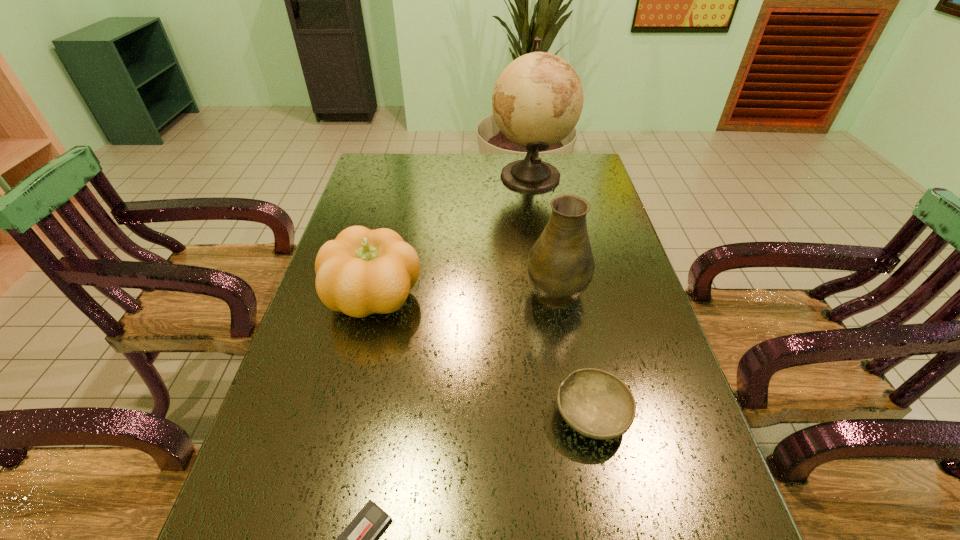
Where is `free spot located on the handle side of the pitcher`? free spot located on the handle side of the pitcher is located at coordinates coord(541,206).

This screenshot has height=540, width=960. In order to click on vacant space situated 0.400m on the handle side of the pitcher in this screenshot , I will do `click(538, 188)`.

Where is `vacant region located 0.380m on the front of the third tallest object`? The width and height of the screenshot is (960, 540). vacant region located 0.380m on the front of the third tallest object is located at coordinates (324, 500).

Where is `vacant space positioned on the left of the bowl`? vacant space positioned on the left of the bowl is located at coordinates (369, 415).

What are the coordinates of `object present at the far edge` in the screenshot? It's located at (537, 100).

I want to click on object located in the left edge section of the desktop, so click(x=361, y=272).

Image resolution: width=960 pixels, height=540 pixels. What are the coordinates of `globe present at the right edge` in the screenshot? It's located at (537, 100).

You are a GUI agent. You are given a task and a screenshot of the screen. Output one action in this format:
    pyautogui.click(x=<x>, y=<y>)
    Task: Click on the pitcher located in the right edge section of the desktop
    The image size is (960, 540).
    Given the screenshot: What is the action you would take?
    pyautogui.click(x=560, y=265)

The width and height of the screenshot is (960, 540). In order to click on bowl situated at the right edge in this screenshot , I will do `click(595, 403)`.

Identify the location of object at the far right corner. (537, 100).